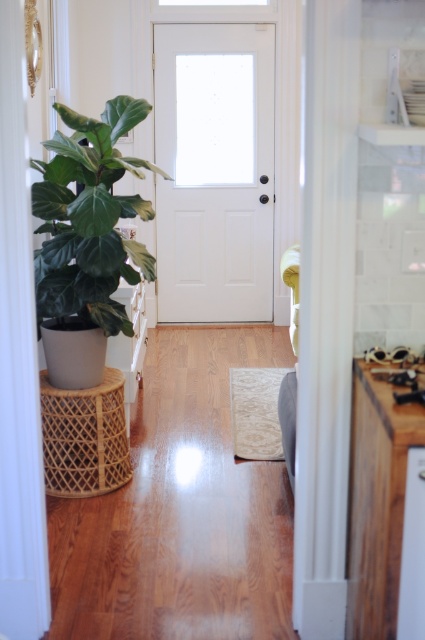
You are moving a large piece of furniture through the hallway. The furniture is as wide as the green matte plant at left. Will it fit through the space where the wooden countertop at right is located?

The green matte plant at left is bigger than the wooden countertop at right, so the furniture, which is as wide as the plant, may not fit through the space where the countertop is located since the countertop is narrower.

From the picture: You are moving a 1.2 meter wide sofa through the hallway. The sofa needs to pass between the green matte plant at left and the wooden countertop at right. Can the sofa fit through the space between them?

The green matte plant at left is wider than the wooden countertop at right. Since the sofa is 1.2 meters wide, it depends on the actual width of the narrowest point between them. However, since the plant is wider, the space might be narrower than 1.2 meters. Without exact measurements, we can infer that the sofa may not fit comfortably. Please check the exact dimensions for confirmation.

You are moving a 7.5 feet long sofa through the hallway. The sofa is currently positioned near the green matte plant at left. Can you maneuver it to the white matte door at center without tilting it sideways?

The distance between the green matte plant at left and the white matte door at center is 8.63 feet. Since the sofa is 7.5 feet long, it can be moved straight through the hallway without tilting as the available space is sufficient.